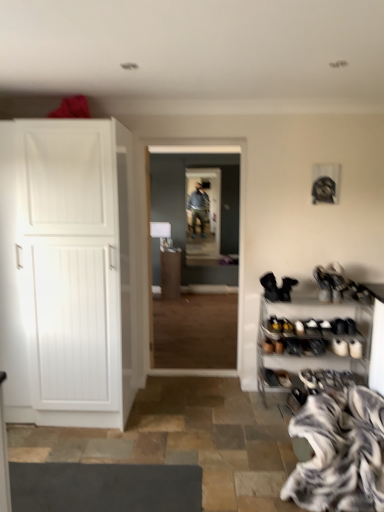
Question: Is wooden floor at center located outside zebra print fur at lower right?

Choices:
 (A) yes
 (B) no

Answer: (A)

Question: Can you confirm if wooden floor at center is thinner than zebra print fur at lower right?

Choices:
 (A) no
 (B) yes

Answer: (B)

Question: Is wooden floor at center positioned with its back to zebra print fur at lower right?

Choices:
 (A) yes
 (B) no

Answer: (B)

Question: Could you tell me if wooden floor at center is turned towards zebra print fur at lower right?

Choices:
 (A) no
 (B) yes

Answer: (A)

Question: Is wooden floor at center wider than zebra print fur at lower right?

Choices:
 (A) yes
 (B) no

Answer: (B)

Question: Is metallic silver shoe rack at lower right wider or thinner than matte white cabinet at center?

Choices:
 (A) wide
 (B) thin

Answer: (B)

Question: Is metallic silver shoe rack at lower right bigger or smaller than matte white cabinet at center?

Choices:
 (A) small
 (B) big

Answer: (B)

Question: Relative to matte white cabinet at center, is metallic silver shoe rack at lower right in front or behind?

Choices:
 (A) behind
 (B) front

Answer: (B)

Question: From the image's perspective, is metallic silver shoe rack at lower right located above or below matte white cabinet at center?

Choices:
 (A) above
 (B) below

Answer: (B)

Question: From their relative heights in the image, would you say black suede boot at lower right, acting as the 2th footwear starting from the right, is taller or shorter than metallic silver shoe rack at lower right?

Choices:
 (A) short
 (B) tall

Answer: (A)

Question: From a real-world perspective, is black suede boot at lower right, the 1th footwear from the left, physically located above or below metallic silver shoe rack at lower right?

Choices:
 (A) above
 (B) below

Answer: (A)

Question: Is black suede boot at lower right, acting as the 2th footwear starting from the right, wider or thinner than metallic silver shoe rack at lower right?

Choices:
 (A) thin
 (B) wide

Answer: (A)

Question: From the image's perspective, is black suede boot at lower right, acting as the 2th footwear starting from the right, positioned above or below metallic silver shoe rack at lower right?

Choices:
 (A) above
 (B) below

Answer: (A)

Question: Considering the positions of zebra print fur at lower right and matte white cabinet at center in the image, is zebra print fur at lower right taller or shorter than matte white cabinet at center?

Choices:
 (A) tall
 (B) short

Answer: (B)

Question: Is zebra print fur at lower right bigger or smaller than matte white cabinet at center?

Choices:
 (A) big
 (B) small

Answer: (A)